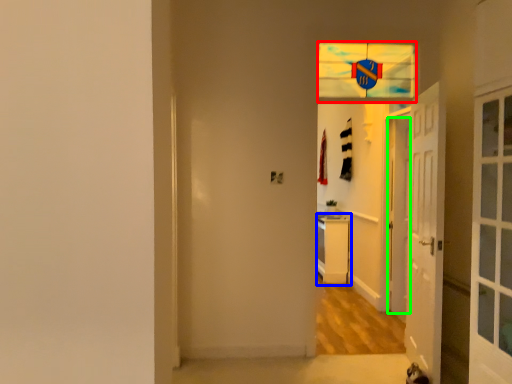
Question: Considering the real-world distances, which object is closest to glass window (highlighted by a red box)? dresser (highlighted by a blue box) or door (highlighted by a green box).

Choices:
 (A) dresser
 (B) door

Answer: (B)